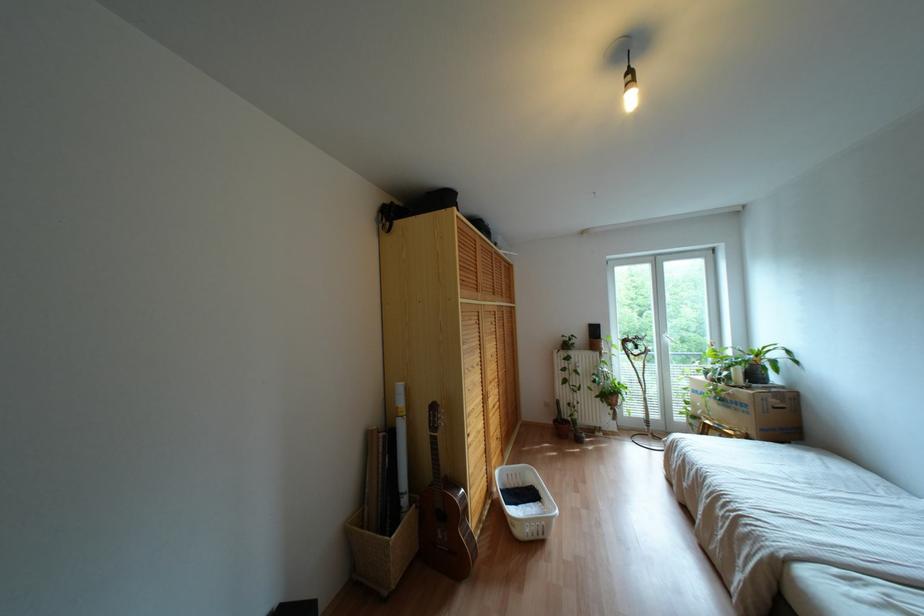
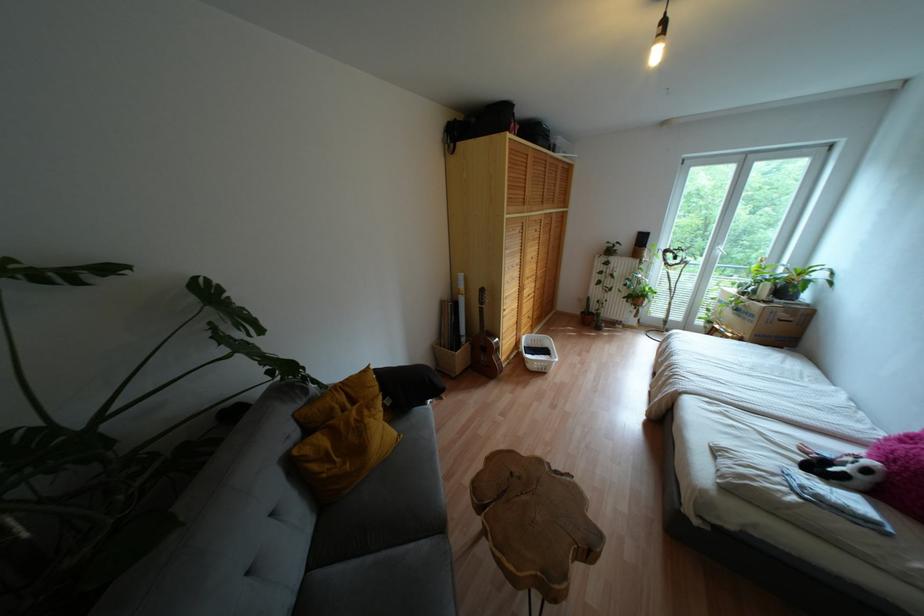
Where in the second image is the point corresponding to (589,411) from the first image?

(614, 309)